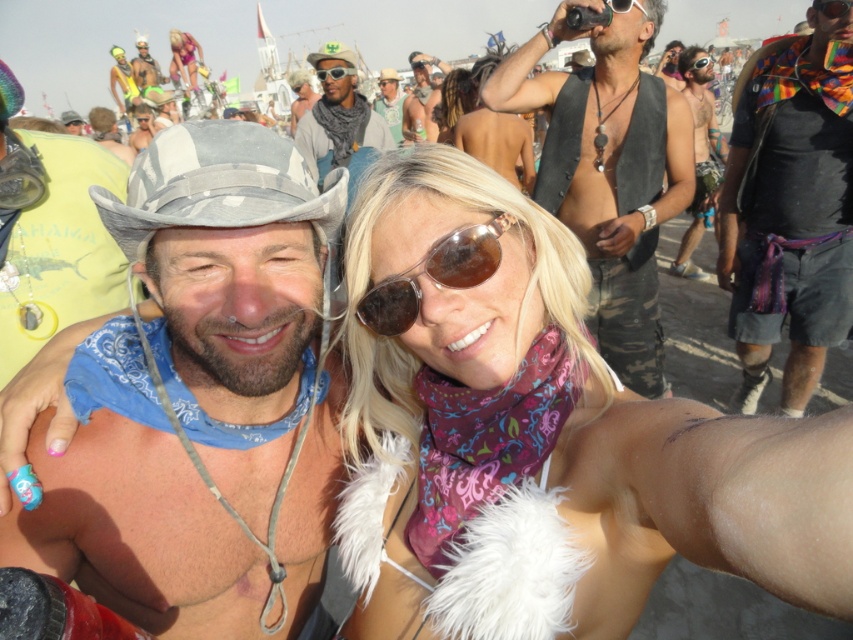
Who is shorter, green felt hat at upper center or sunglasses at center?

sunglasses at center is shorter.

Can you confirm if green felt hat at upper center is positioned to the left of sunglasses at center?

Indeed, green felt hat at upper center is positioned on the left side of sunglasses at center.

At what (x,y) coordinates should I click in order to perform the action: click on green felt hat at upper center. Please return your answer as a coordinate pair (x, y). This screenshot has height=640, width=853. Looking at the image, I should click on (340, 120).

This screenshot has width=853, height=640. Identify the location of green felt hat at upper center. (340, 120).

Is green fabric shirt at upper center shorter than matte black cowboy hat at upper left?

Indeed, green fabric shirt at upper center has a lesser height compared to matte black cowboy hat at upper left.

Who is taller, green fabric shirt at upper center or matte black cowboy hat at upper left?

matte black cowboy hat at upper left

This screenshot has height=640, width=853. Find the location of `green fabric shirt at upper center`. green fabric shirt at upper center is located at coordinates (390, 102).

Which is behind, point (779, 177) or point (699, 58)?

The point (699, 58) is behind.

Between multicolored scarf at right and matte black goggles at upper center, which one appears on the left side from the viewer's perspective?

multicolored scarf at right

Who is more forward, (772,339) or (711,60)?

Point (772,339) is in front.

The width and height of the screenshot is (853, 640). I want to click on multicolored scarf at right, so click(x=791, y=211).